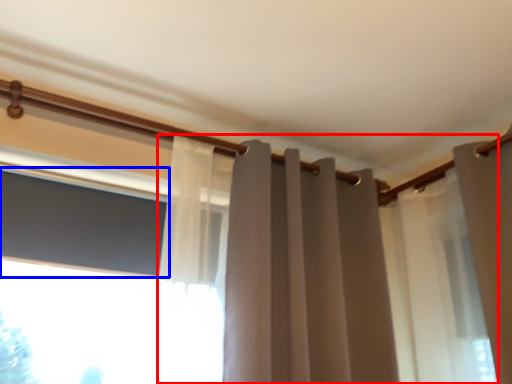
Question: Which object is closer to the camera taking this photo, curtain (highlighted by a red box) or window screen (highlighted by a blue box)?

Choices:
 (A) curtain
 (B) window screen

Answer: (A)